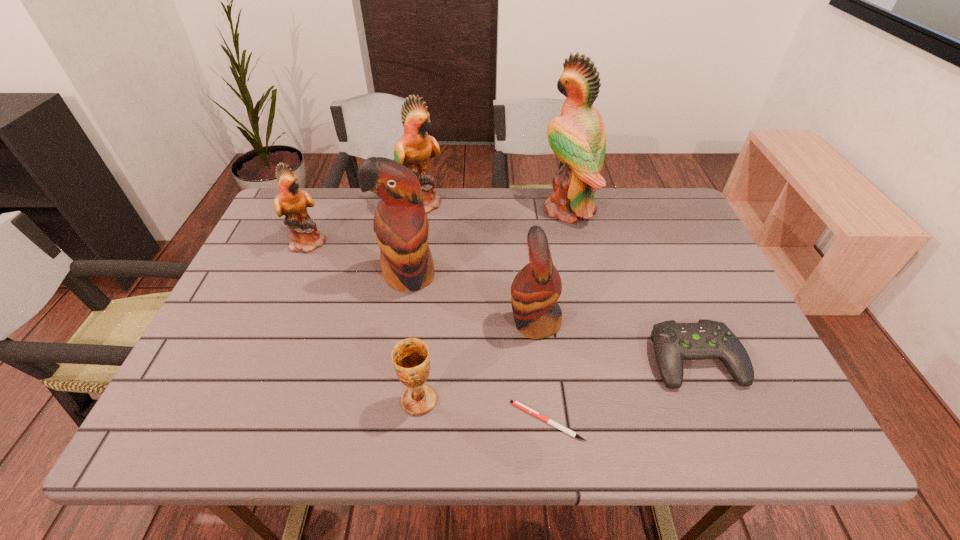
Where is `vacant space situated 0.260m on the face of the smaller red parrot`? vacant space situated 0.260m on the face of the smaller red parrot is located at coordinates (399, 322).

Where is `vacant space located on the face of the smaller red parrot`? vacant space located on the face of the smaller red parrot is located at coordinates (399, 322).

The width and height of the screenshot is (960, 540). Identify the location of vacant space located on the face of the smaller red parrot. (458, 322).

The height and width of the screenshot is (540, 960). Find the location of `vacant space situated on the left of the chalice`. vacant space situated on the left of the chalice is located at coordinates (357, 400).

This screenshot has width=960, height=540. Find the location of `free space located on the back of the rightmost object`. free space located on the back of the rightmost object is located at coordinates (646, 239).

Find the location of `vacant space situated on the clicker of the shortest object`. vacant space situated on the clicker of the shortest object is located at coordinates (320, 421).

Find the location of a particular element. vacant area situated 0.350m on the clicker of the shortest object is located at coordinates (335, 421).

Locate an element on the screen. This screenshot has width=960, height=540. vacant space located 0.330m on the clicker of the shortest object is located at coordinates (345, 421).

The height and width of the screenshot is (540, 960). In order to click on chalice located at the near edge in this screenshot , I will do `click(410, 357)`.

I want to click on pen that is at the near edge, so click(x=517, y=404).